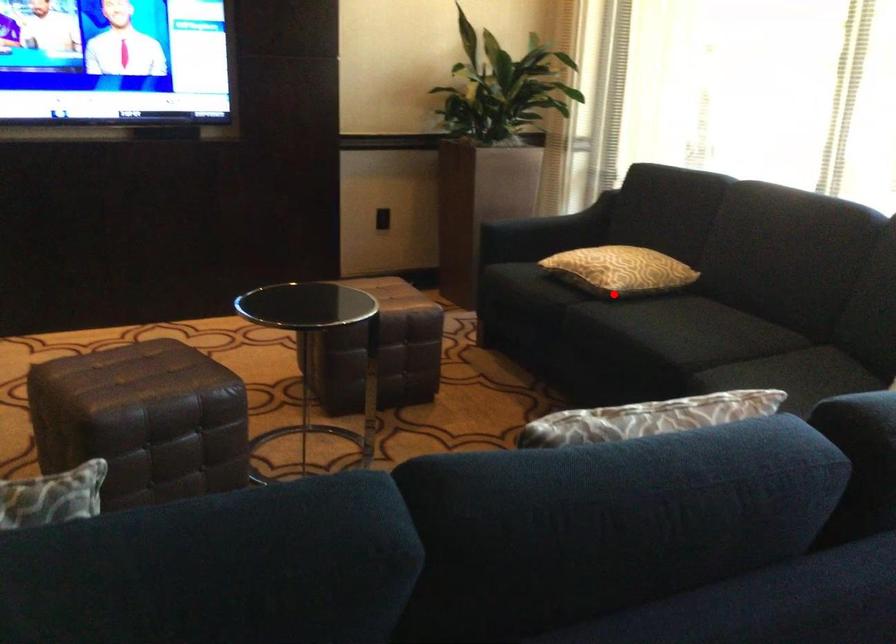
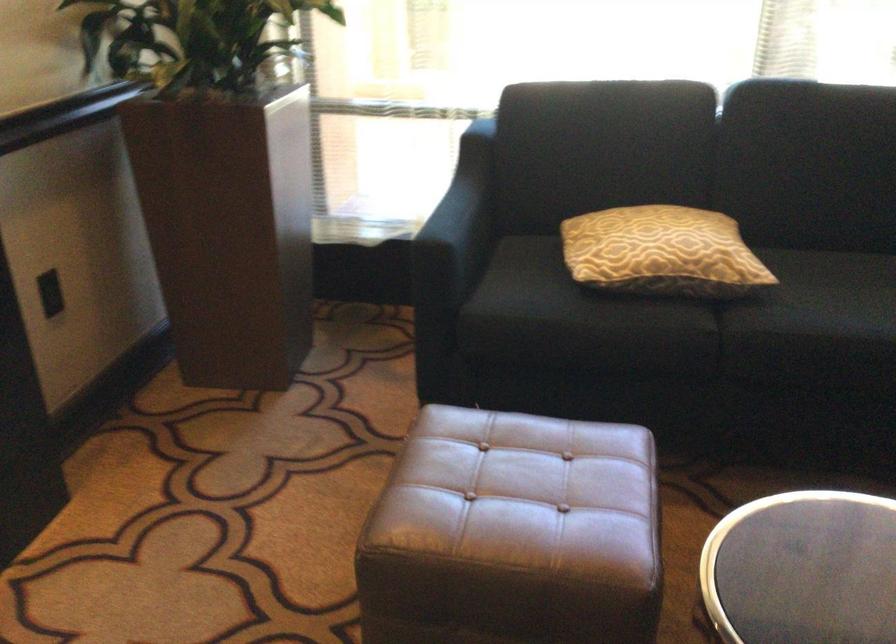
Where in the second image is the point corresponding to the highlighted location from the first image?

(752, 289)